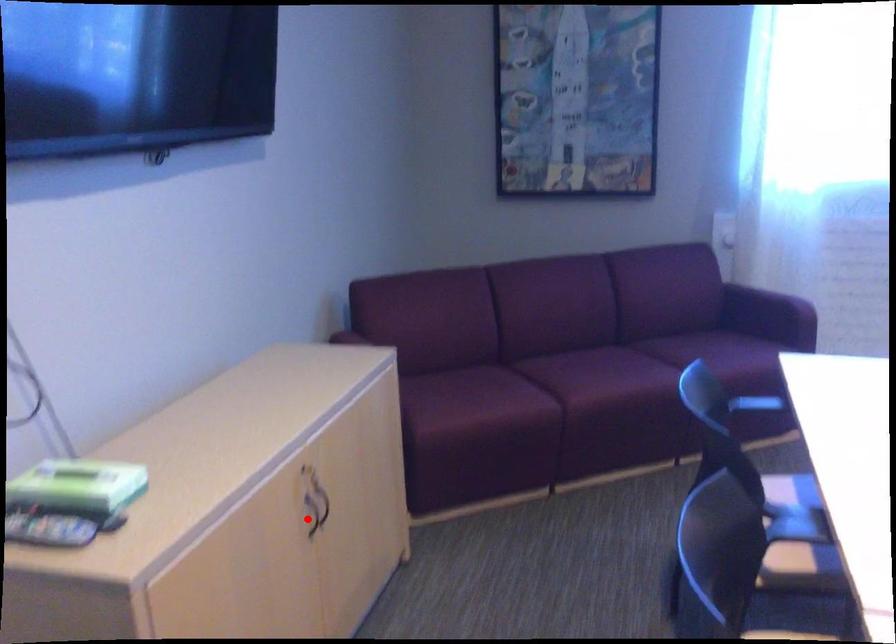
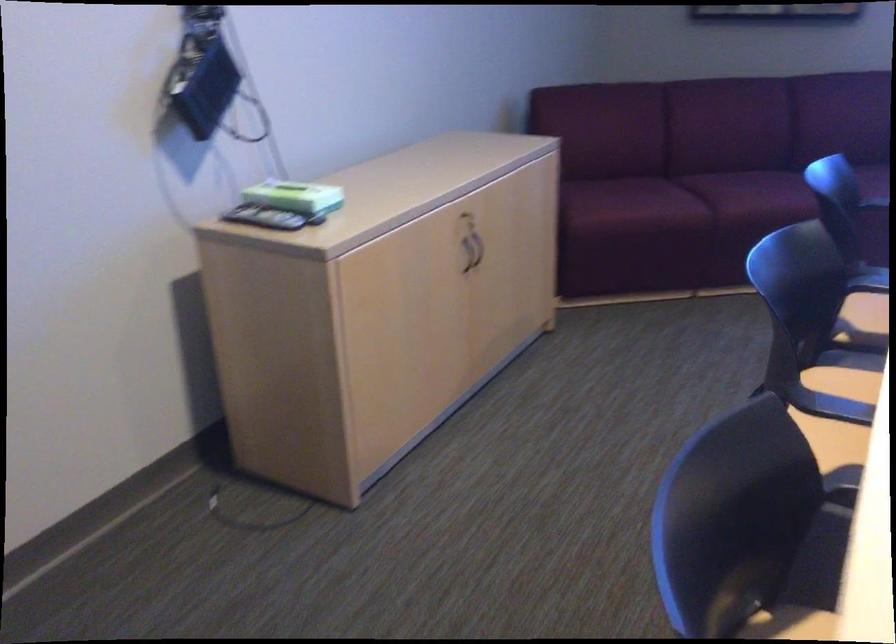
Question: I am providing you with two images of the same scene from different viewpoints. Image1 has a red point marked. In image2, the corresponding 3D location appears at what relative position? Reply with the corresponding letter.

Choices:
 (A) Closer
 (B) Farther

Answer: (B)